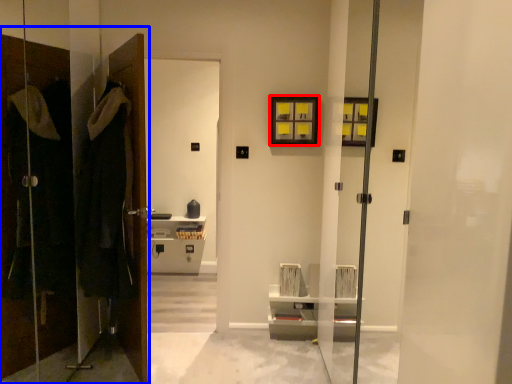
Question: Which point is further to the camera, picture frame (highlighted by a red box) or closet (highlighted by a blue box)?

Choices:
 (A) picture frame
 (B) closet

Answer: (A)